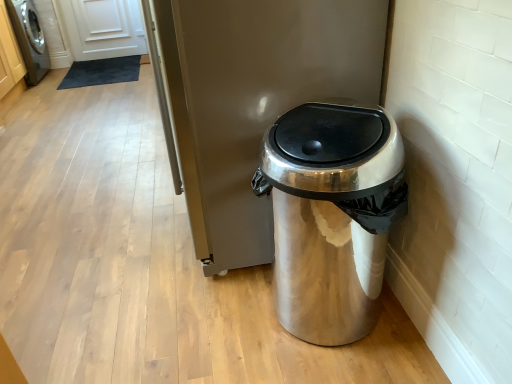
Question: From a real-world perspective, is shiny metallic trash can at lower right physically located above or below brushed metal washing machine at left?

Choices:
 (A) above
 (B) below

Answer: (B)

Question: Is shiny metallic trash can at lower right wider or thinner than brushed metal washing machine at left?

Choices:
 (A) wide
 (B) thin

Answer: (A)

Question: Which object is the farthest from the shiny metallic trash can at lower right?

Choices:
 (A) brushed metal washing machine at left
 (B) satin silver trash can at center

Answer: (A)

Question: Which object is the closest to the shiny metallic trash can at lower right?

Choices:
 (A) brushed metal washing machine at left
 (B) satin silver trash can at center

Answer: (B)